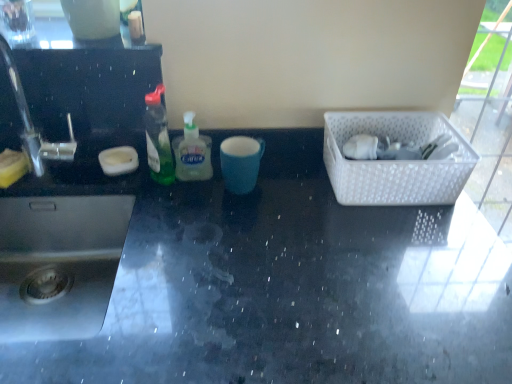
Question: Is black glossy countertop at center far away from white plastic basket at right?

Choices:
 (A) no
 (B) yes

Answer: (A)

Question: Considering the relative sizes of black glossy countertop at center and white plastic basket at right in the image provided, is black glossy countertop at center taller than white plastic basket at right?

Choices:
 (A) yes
 (B) no

Answer: (A)

Question: Considering the relative sizes of black glossy countertop at center and white plastic basket at right in the image provided, is black glossy countertop at center wider than white plastic basket at right?

Choices:
 (A) no
 (B) yes

Answer: (B)

Question: Is the depth of black glossy countertop at center less than that of white plastic basket at right?

Choices:
 (A) yes
 (B) no

Answer: (A)

Question: Is black glossy countertop at center behind white plastic basket at right?

Choices:
 (A) yes
 (B) no

Answer: (B)

Question: Does black glossy countertop at center contain white plastic basket at right?

Choices:
 (A) yes
 (B) no

Answer: (B)

Question: From the image's perspective, is translucent green liquid soap at center, marked as the first bottle in a right-to-left arrangement, located beneath green translucent bottle at center, placed as the first bottle when sorted from left to right?

Choices:
 (A) yes
 (B) no

Answer: (A)

Question: From the image's perspective, is translucent green liquid soap at center, marked as the first bottle in a right-to-left arrangement, over green translucent bottle at center, placed as the first bottle when sorted from left to right?

Choices:
 (A) no
 (B) yes

Answer: (A)

Question: Considering the relative sizes of translucent green liquid soap at center, marked as the first bottle in a right-to-left arrangement, and green translucent bottle at center, acting as the 2th bottle starting from the right, in the image provided, is translucent green liquid soap at center, marked as the first bottle in a right-to-left arrangement, wider than green translucent bottle at center, acting as the 2th bottle starting from the right,?

Choices:
 (A) no
 (B) yes

Answer: (A)

Question: Is translucent green liquid soap at center, marked as the first bottle in a right-to-left arrangement, not near green translucent bottle at center, acting as the 2th bottle starting from the right?

Choices:
 (A) yes
 (B) no

Answer: (B)

Question: Is translucent green liquid soap at center, marked as the first bottle in a right-to-left arrangement, shorter than green translucent bottle at center, placed as the first bottle when sorted from left to right?

Choices:
 (A) yes
 (B) no

Answer: (A)

Question: Considering the relative positions of translucent green liquid soap at center, marked as the second bottle in a left-to-right arrangement, and green translucent bottle at center, acting as the 2th bottle starting from the right, in the image provided, is translucent green liquid soap at center, marked as the second bottle in a left-to-right arrangement, to the left of green translucent bottle at center, acting as the 2th bottle starting from the right, from the viewer's perspective?

Choices:
 (A) no
 (B) yes

Answer: (A)

Question: Considering the relative positions of translucent green liquid soap at center, marked as the first bottle in a right-to-left arrangement, and white plastic basket at right in the image provided, is translucent green liquid soap at center, marked as the first bottle in a right-to-left arrangement, to the left of white plastic basket at right from the viewer's perspective?

Choices:
 (A) no
 (B) yes

Answer: (B)